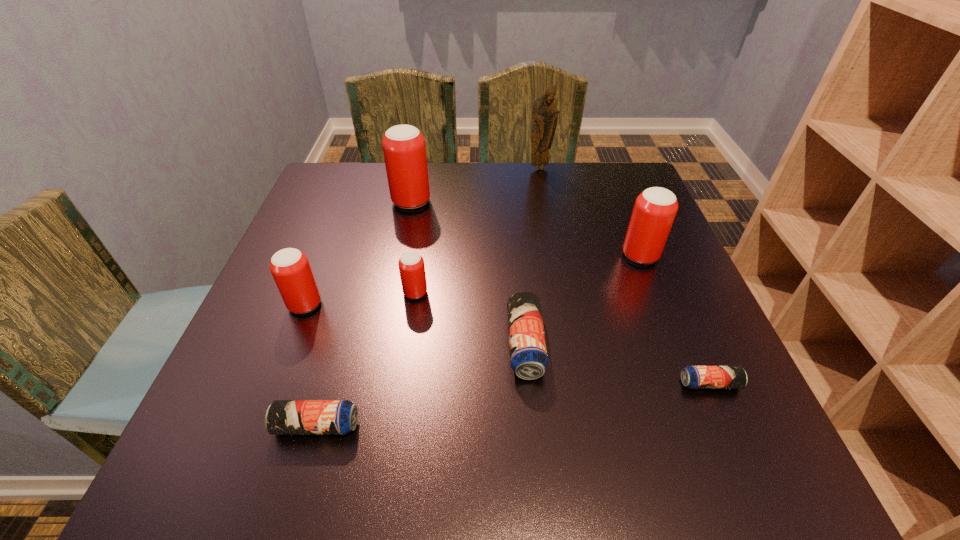
At what (x,y) coordinates should I click in order to perform the action: click on free space that is in between the nearest object and the third smallest red beer can. Please return your answer as a coordinate pair (x, y). Looking at the image, I should click on (478, 341).

The width and height of the screenshot is (960, 540). Identify the location of free point between the third object from right to left and the nearest beer can. (428, 296).

Locate an element on the screen. vacant area that lies between the figurine and the farthest beer can is located at coordinates (475, 185).

Locate an element on the screen. This screenshot has width=960, height=540. free spot between the fourth tallest beer can and the farthest object is located at coordinates pyautogui.click(x=477, y=231).

The width and height of the screenshot is (960, 540). I want to click on object that is the closest to the smallest red beer can, so click(290, 268).

Where is `object that ranks as the closest to the rightmost blue beer can`? This screenshot has height=540, width=960. object that ranks as the closest to the rightmost blue beer can is located at coordinates (528, 355).

Identify the location of beer can that stands as the fourth closest to the rightmost red beer can. (404, 149).

Image resolution: width=960 pixels, height=540 pixels. Identify the location of beer can identified as the sixth closest to the farthest beer can. (694, 377).

The height and width of the screenshot is (540, 960). I want to click on red beer can that is the fourth closest to the third beer can from right to left, so click(404, 149).

Locate which red beer can ranks in proximity to the fifth tallest object. Please provide its 2D coordinates. Your answer should be formatted as a tuple, i.e. [(x, y)], where the tuple contains the x and y coordinates of a point satisfying the conditions above.

[(290, 268)]